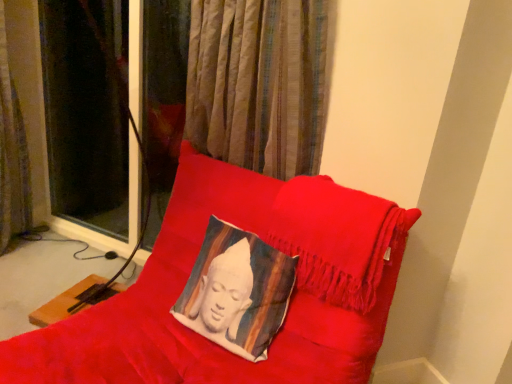
Question: Considering the relative sizes of brown textured curtain at left and silky white cushion at center in the image provided, is brown textured curtain at left bigger than silky white cushion at center?

Choices:
 (A) no
 (B) yes

Answer: (B)

Question: Is brown textured curtain at left positioned with its back to silky white cushion at center?

Choices:
 (A) no
 (B) yes

Answer: (A)

Question: Are brown textured curtain at left and silky white cushion at center located far from each other?

Choices:
 (A) yes
 (B) no

Answer: (A)

Question: Considering the relative sizes of brown textured curtain at left and silky white cushion at center in the image provided, is brown textured curtain at left taller than silky white cushion at center?

Choices:
 (A) no
 (B) yes

Answer: (B)

Question: Does brown textured curtain at left have a lesser height compared to silky white cushion at center?

Choices:
 (A) no
 (B) yes

Answer: (A)

Question: Based on their positions, is silky white cushion at center located to the left or right of brown textured curtain at left?

Choices:
 (A) right
 (B) left

Answer: (A)

Question: Relative to brown textured curtain at left, is silky white cushion at center in front or behind?

Choices:
 (A) front
 (B) behind

Answer: (A)

Question: Choose the correct answer: Is silky white cushion at center inside brown textured curtain at left or outside it?

Choices:
 (A) inside
 (B) outside

Answer: (B)

Question: Based on their sizes in the image, would you say silky white cushion at center is bigger or smaller than brown textured curtain at left?

Choices:
 (A) small
 (B) big

Answer: (A)

Question: From the image's perspective, is velvet cushion at center located above or below silky white cushion at center?

Choices:
 (A) below
 (B) above

Answer: (A)

Question: From a real-world perspective, is velvet cushion at center positioned above or below silky white cushion at center?

Choices:
 (A) below
 (B) above

Answer: (A)

Question: Considering their positions, is velvet cushion at center located in front of or behind silky white cushion at center?

Choices:
 (A) behind
 (B) front

Answer: (B)

Question: Is velvet cushion at center wider or thinner than silky white cushion at center?

Choices:
 (A) wide
 (B) thin

Answer: (A)

Question: From their relative heights in the image, would you say silky white cushion at center is taller or shorter than velvet cushion at center?

Choices:
 (A) tall
 (B) short

Answer: (B)

Question: From a real-world perspective, is silky white cushion at center positioned above or below velvet cushion at center?

Choices:
 (A) above
 (B) below

Answer: (A)